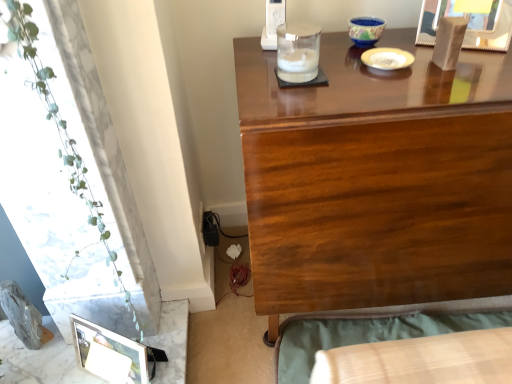
Question: Is metallic silver picture frame at lower left, the first picture frame ordered from the bottom, wider or thinner than wooden bed frame at lower right?

Choices:
 (A) wide
 (B) thin

Answer: (B)

Question: Is metallic silver picture frame at lower left, positioned as the second picture frame in right-to-left order, situated inside wooden bed frame at lower right or outside?

Choices:
 (A) outside
 (B) inside

Answer: (A)

Question: Considering the real-world distances, which object is farthest from the glossy wood desk at upper center?

Choices:
 (A) white glossy plate at upper center
 (B) wooden bed frame at lower right
 (C) wooden picture frame at upper right, the first picture frame positioned from the top
 (D) clear glass candle holder at upper center, arranged as the 1th candle holder when viewed from the front
 (E) blue ceramic bowl at upper center, which appears as the second candle holder when viewed from the front

Answer: (E)

Question: Which object is the closest to the metallic silver picture frame at lower left, the first picture frame ordered from the bottom?

Choices:
 (A) white glossy plate at upper center
 (B) glossy wood desk at upper center
 (C) wooden bed frame at lower right
 (D) clear glass candle holder at upper center, acting as the 2th candle holder starting from the top
 (E) blue ceramic bowl at upper center, which is the 2th candle holder from bottom to top

Answer: (C)